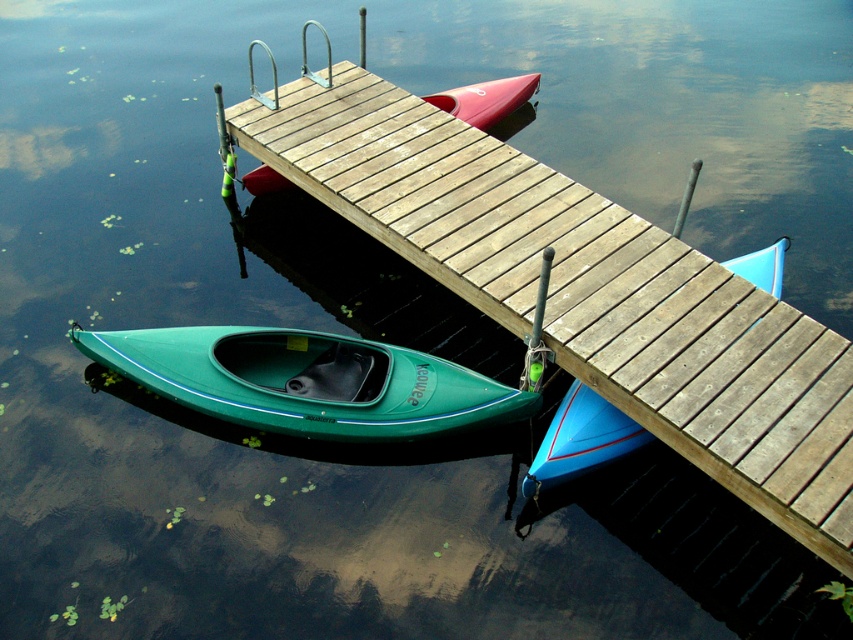
Question: Can you confirm if green matte kayak at lower left is thinner than matte red canoe at center?

Choices:
 (A) no
 (B) yes

Answer: (A)

Question: Which of the following is the closest to the observer?

Choices:
 (A) 457,88
 (B) 277,397

Answer: (B)

Question: Based on their relative distances, which object is nearer to the wooden dock at center?

Choices:
 (A) green matte kayak at lower left
 (B) matte red canoe at center

Answer: (A)

Question: Which of the following is the closest to the observer?

Choices:
 (A) green matte kayak at lower left
 (B) wooden dock at center
 (C) matte red canoe at center

Answer: (B)

Question: Does green matte kayak at lower left have a greater width compared to blue matte canoe at center?

Choices:
 (A) yes
 (B) no

Answer: (A)

Question: Can you confirm if green matte kayak at lower left is bigger than matte red canoe at center?

Choices:
 (A) yes
 (B) no

Answer: (A)